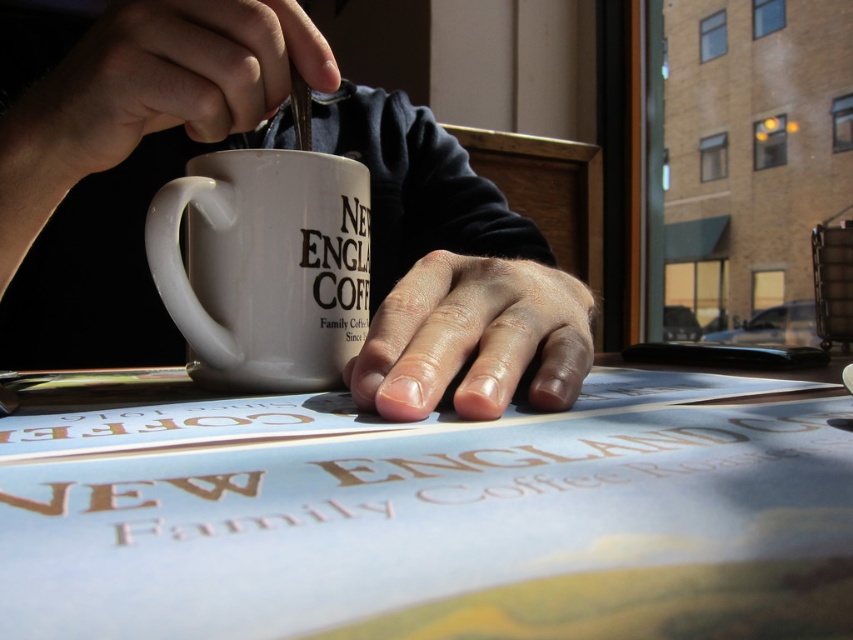
From the picture: Can you confirm if white matte mug at center is positioned to the right of dry skin at center?

No, white matte mug at center is not to the right of dry skin at center.

Who is positioned more to the right, white matte mug at center or dry skin at center?

Positioned to the right is dry skin at center.

Who is more distant from viewer, (212, 120) or (486, 384)?

The point (212, 120) is more distant.

This screenshot has height=640, width=853. I want to click on white matte mug at center, so click(x=328, y=148).

Does white matte mug at center have a lesser height compared to white ceramic mug at center?

Incorrect, white matte mug at center's height does not fall short of white ceramic mug at center's.

Is point (315, 64) more distant than point (328, 298)?

No, (315, 64) is closer to viewer.

Where is `white matte mug at center`? This screenshot has width=853, height=640. white matte mug at center is located at coordinates (328, 148).

Is point (219, 81) closer to camera compared to point (102, 145)?

Yes.

Which of these two, white matte mug at center or smooth skin hand at upper left, stands shorter?

With less height is smooth skin hand at upper left.

What do you see at coordinates (328, 148) in the screenshot? I see `white matte mug at center` at bounding box center [328, 148].

Where is `white matte mug at center`? white matte mug at center is located at coordinates (328, 148).